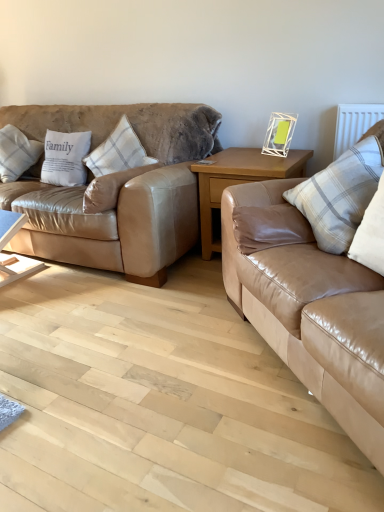
Identify the location of free spot in front of white plastic picture frame at upper right. (284, 161).